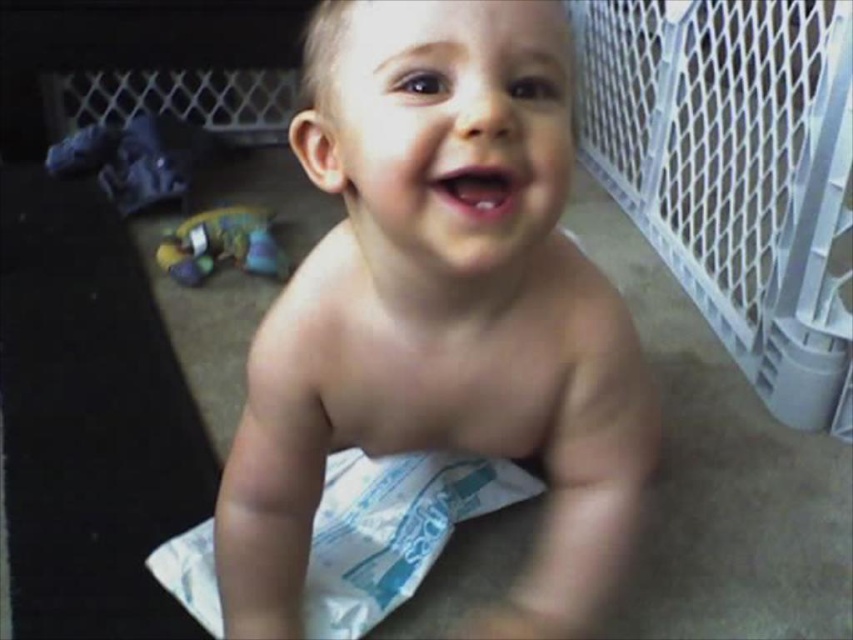
Does white paper diaper at center have a larger size compared to plush multicolored toy at lower left?

Correct, white paper diaper at center is larger in size than plush multicolored toy at lower left.

Between point (409, 508) and point (221, 243), which one is positioned behind?

Positioned behind is point (221, 243).

The image size is (853, 640). What do you see at coordinates (392, 529) in the screenshot?
I see `white paper diaper at center` at bounding box center [392, 529].

I want to click on white paper diaper at center, so click(x=392, y=529).

Which is more to the left, white cloth diaper at center or white paper diaper at center?

From the viewer's perspective, white paper diaper at center appears more on the left side.

Between point (561, 172) and point (448, 513), which one is positioned in front?

Point (561, 172) is in front.

At what (x,y) coordinates should I click in order to perform the action: click on white cloth diaper at center. Please return your answer as a coordinate pair (x, y). Image resolution: width=853 pixels, height=640 pixels. Looking at the image, I should click on (440, 310).

This screenshot has width=853, height=640. Find the location of `white cloth diaper at center`. white cloth diaper at center is located at coordinates (440, 310).

The height and width of the screenshot is (640, 853). Describe the element at coordinates (440, 310) in the screenshot. I see `white cloth diaper at center` at that location.

Does point (241, 621) lie behind point (271, 272)?

No, it is in front of (271, 272).

The height and width of the screenshot is (640, 853). What are the coordinates of `white cloth diaper at center` in the screenshot? It's located at (440, 310).